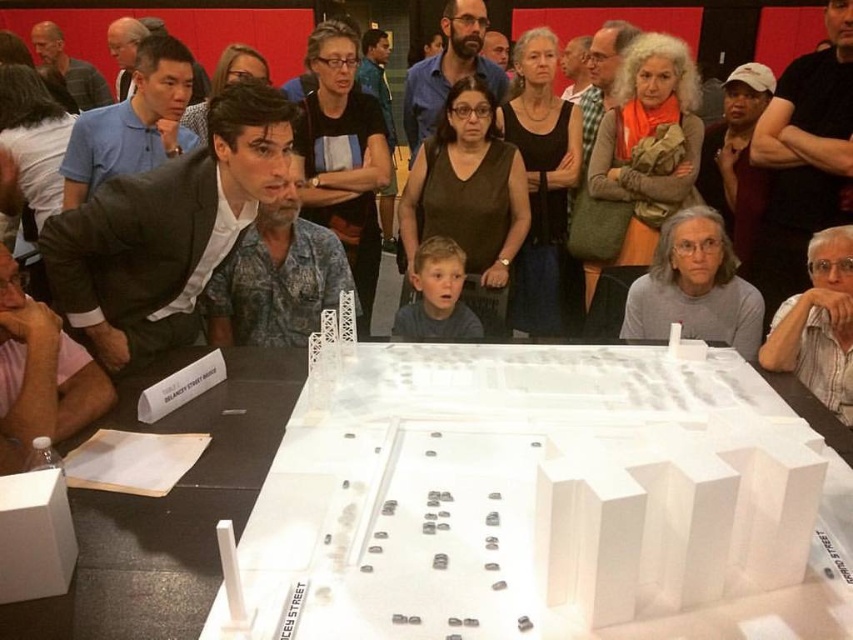
Can you confirm if white plastic table at center is taller than blonde hair boy at center?

Yes.

Which is more to the left, white plastic table at center or blonde hair boy at center?

white plastic table at center is more to the left.

Which is in front, point (103, 577) or point (408, 307)?

Point (103, 577) is in front.

Identify the location of white plastic table at center. Image resolution: width=853 pixels, height=640 pixels. (167, 515).

Is white plastic table at center to the right of matte black suit at center from the viewer's perspective?

No, white plastic table at center is not to the right of matte black suit at center.

Image resolution: width=853 pixels, height=640 pixels. What do you see at coordinates (167, 515) in the screenshot?
I see `white plastic table at center` at bounding box center [167, 515].

Identify the location of white plastic table at center. The image size is (853, 640). (167, 515).

Is white plastic table at center positioned behind gray matte shirt at lower right?

No, it is not.

Does point (216, 428) come closer to viewer compared to point (695, 282)?

Yes, point (216, 428) is closer to viewer.

Image resolution: width=853 pixels, height=640 pixels. I want to click on white plastic table at center, so click(x=167, y=515).